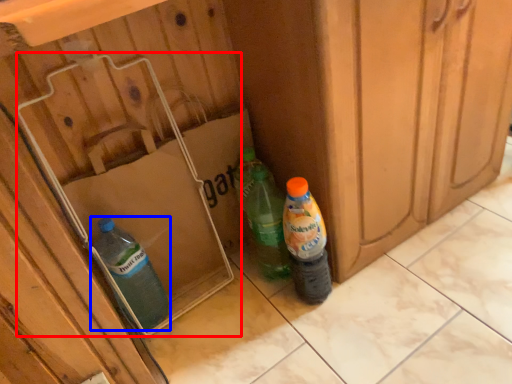
Question: Which object is closer to the camera taking this photo, cardboard box (highlighted by a red box) or bottle (highlighted by a blue box)?

Choices:
 (A) cardboard box
 (B) bottle

Answer: (A)